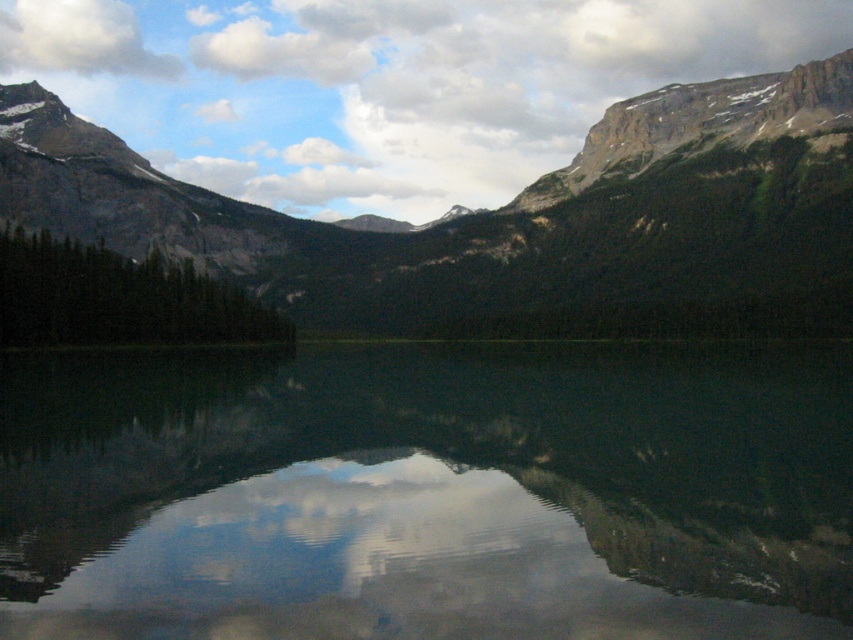
Question: Among these objects, which one is nearest to the camera?

Choices:
 (A) transparent glass water at center
 (B) white fluffy cloud at upper left
 (C) rocky mountain range at center

Answer: (A)

Question: Does transparent glass water at center have a lesser width compared to white fluffy cloud at upper left?

Choices:
 (A) yes
 (B) no

Answer: (B)

Question: Which point appears farthest from the camera in this image?

Choices:
 (A) (622, 560)
 (B) (671, 259)

Answer: (B)

Question: Among these objects, which one is farthest from the camera?

Choices:
 (A) rocky mountain range at center
 (B) white fluffy cloud at upper left
 (C) transparent glass water at center

Answer: (B)

Question: Is transparent glass water at center to the right of white fluffy cloud at upper left from the viewer's perspective?

Choices:
 (A) yes
 (B) no

Answer: (A)

Question: Can you confirm if transparent glass water at center is smaller than white fluffy cloud at upper left?

Choices:
 (A) yes
 (B) no

Answer: (B)